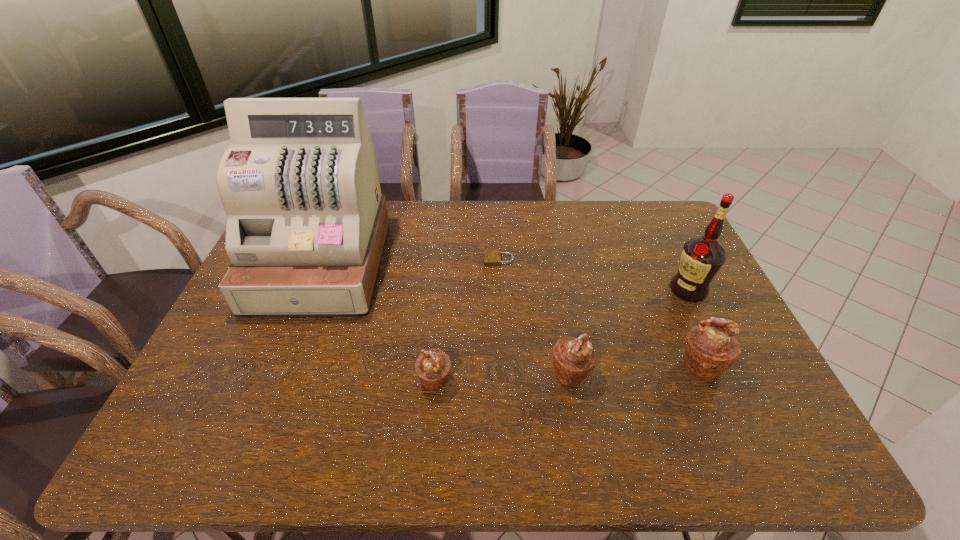
Find the location of `free point that keeps the muffins evenly spaced on the left`. free point that keeps the muffins evenly spaced on the left is located at coordinates (296, 389).